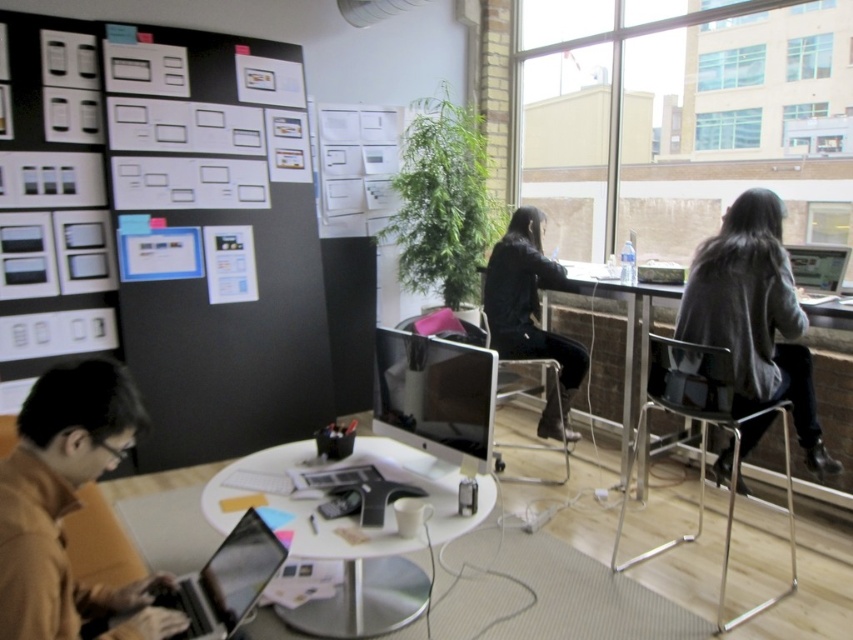
You are organizing the items on the round white table in the modern office scene. You need to place a new notebook to the right of the silver metallic laptop at lower left. Where should you position the notebook relative to the brown leather jacket at lower left?

You should place the notebook to the right of the silver metallic laptop at lower left, which would be to the right of the brown leather jacket at lower left since the brown leather jacket at lower left is positioned to the left of the silver metallic laptop at lower left.

You are a delivery person who needs to place a package on the table. The package requires a clear space of 3 meters between the brown leather jacket at lower left and the silver metallic laptop at center. Is there enough space available on the table?

The brown leather jacket at lower left and silver metallic laptop at center are 2.78 meters apart from each other. Since the required space is 3 meters, there is not enough space available on the table.